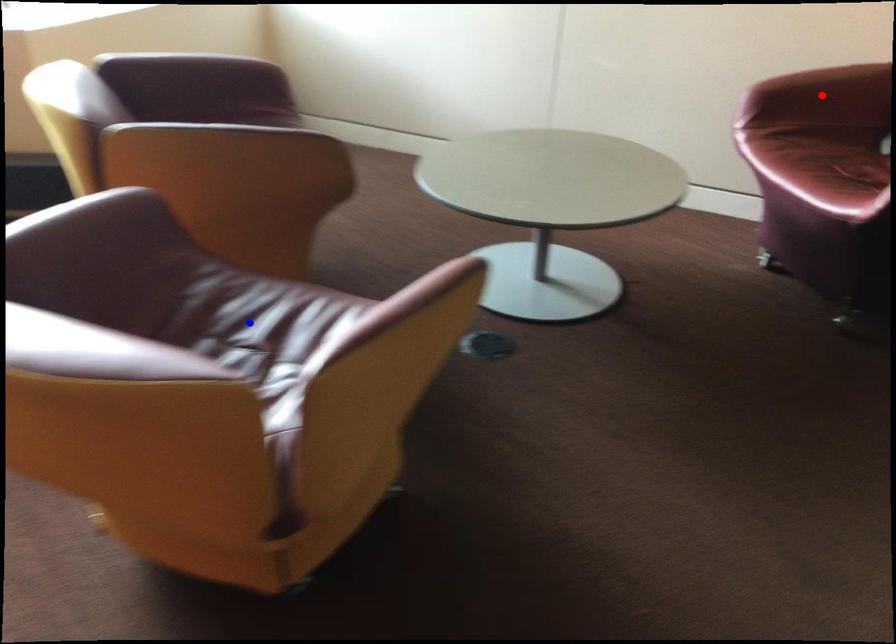
Question: In the image, two points are highlighted. Which point is nearer to the camera? Reply with the corresponding letter.

Choices:
 (A) blue point
 (B) red point

Answer: (A)